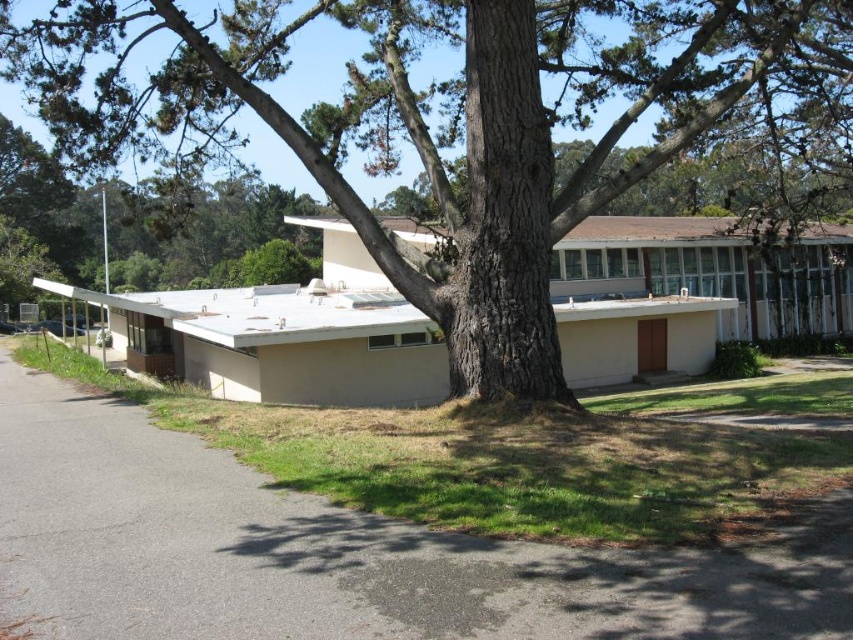
Can you confirm if brown rough tree at center is shorter than gray asphalt driveway at lower left?

No, brown rough tree at center is not shorter than gray asphalt driveway at lower left.

Between brown rough tree at center and gray asphalt driveway at lower left, which one appears on the left side from the viewer's perspective?

From the viewer's perspective, gray asphalt driveway at lower left appears more on the left side.

Locate an element on the screen. brown rough tree at center is located at coordinates (439, 124).